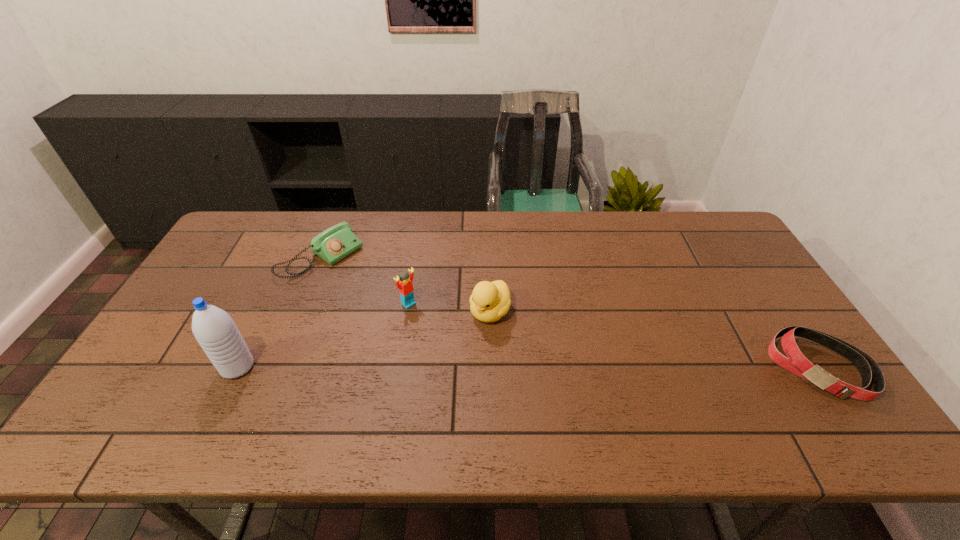
Identify the location of vacant space in between the farthest object and the tallest object. (279, 313).

Where is `free spot between the water bottle and the duck`? This screenshot has height=540, width=960. free spot between the water bottle and the duck is located at coordinates (364, 339).

At what (x,y) coordinates should I click in order to perform the action: click on empty space between the tallest object and the duck. Please return your answer as a coordinate pair (x, y). Looking at the image, I should click on (364, 339).

You are a GUI agent. You are given a task and a screenshot of the screen. Output one action in this format:
    pyautogui.click(x=<x>, y=<y>)
    Task: Click on the vacant area between the tallest object and the fourth object from left to right
    This screenshot has height=540, width=960.
    Given the screenshot: What is the action you would take?
    pyautogui.click(x=364, y=339)

The image size is (960, 540). Identify the location of free space between the dog collar and the telephone. (570, 313).

At what (x,y) coordinates should I click in order to perform the action: click on object that ranks as the third closest to the farthest object. Please return your answer as a coordinate pair (x, y). The width and height of the screenshot is (960, 540). Looking at the image, I should click on (490, 301).

Identify which object is located as the second nearest to the farthest object. Please provide its 2D coordinates. Your answer should be formatted as a tuple, i.e. [(x, y)], where the tuple contains the x and y coordinates of a point satisfying the conditions above.

[(214, 329)]

Identify the location of vacant space that satisfies the following two spatial constraints: 1. on the back side of the water bottle; 2. on the left side of the Lego. Image resolution: width=960 pixels, height=540 pixels. (268, 303).

Where is `free location that satisfies the following two spatial constraints: 1. on the back side of the third object from right to left; 2. on the left side of the tallest object`? This screenshot has height=540, width=960. free location that satisfies the following two spatial constraints: 1. on the back side of the third object from right to left; 2. on the left side of the tallest object is located at coordinates (268, 303).